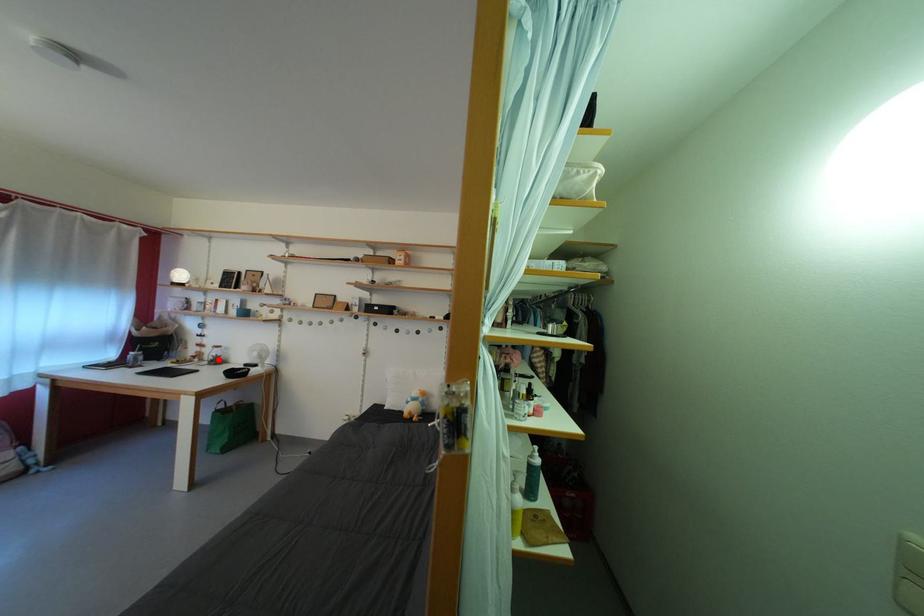
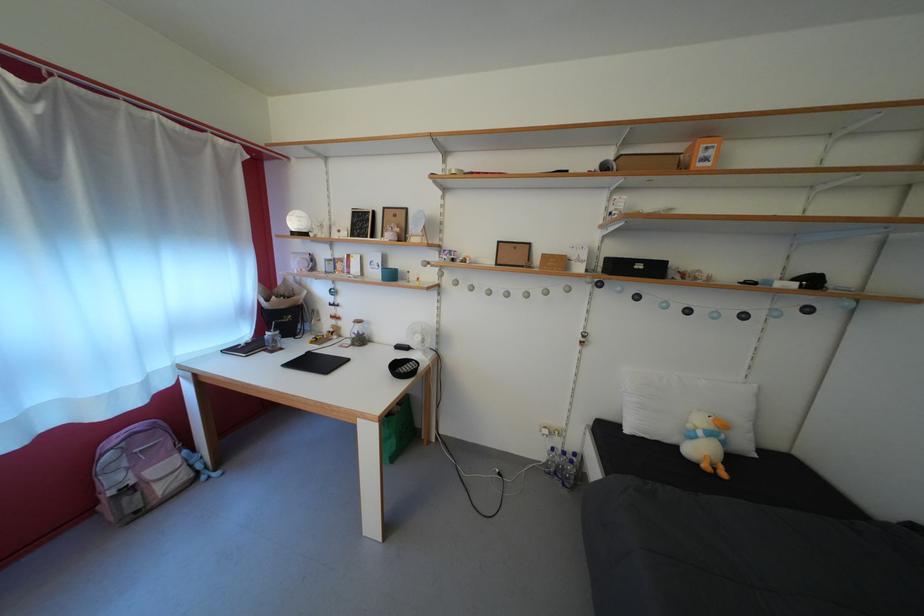
Question: I am providing you with two images of the same scene from different viewpoints. Image1 has a red point marked. In image2, the corresponding 3D location appears at what relative position? Reply with the corresponding letter.

Choices:
 (A) Closer
 (B) Farther

Answer: (B)